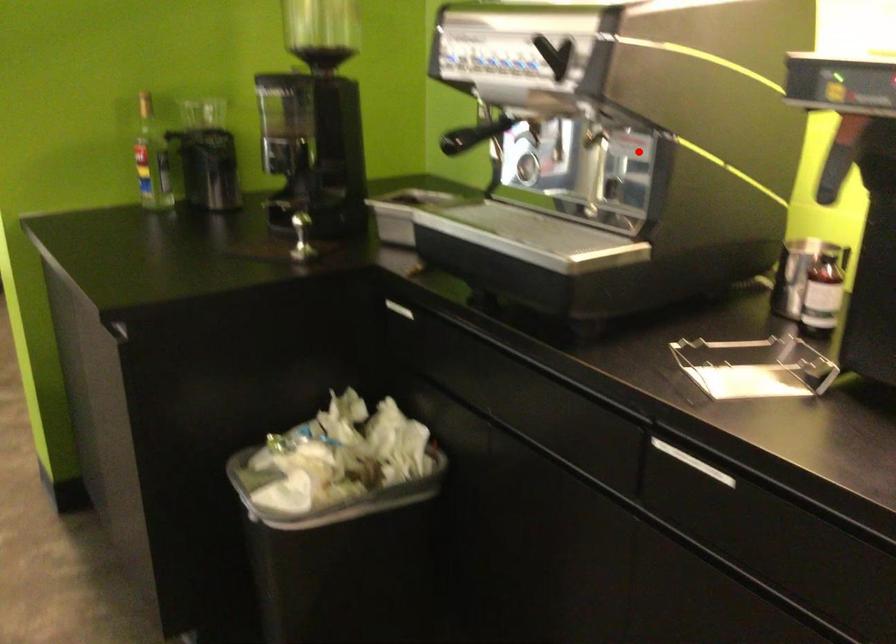
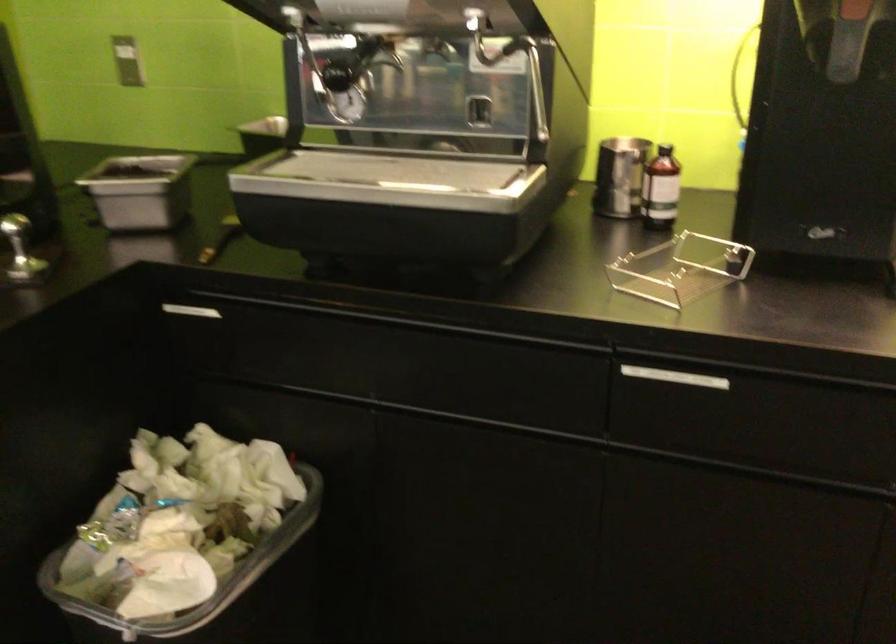
Where in the second image is the point corresponding to the highlighted location from the first image?

(513, 64)